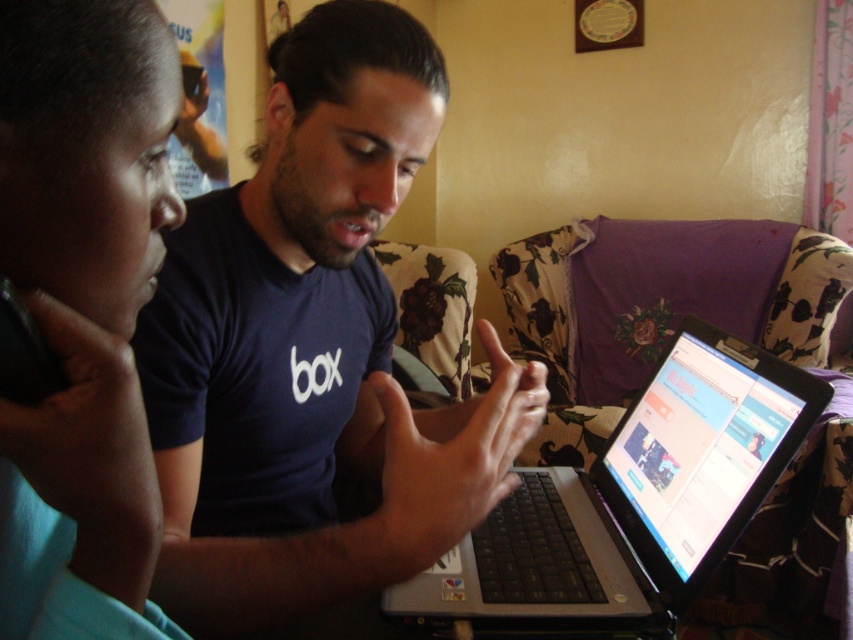
Question: Can you confirm if matte blue shirt at center is smaller than blue fabric at left?

Choices:
 (A) yes
 (B) no

Answer: (B)

Question: Among these points, which one is farthest from the camera?

Choices:
 (A) (482, 564)
 (B) (427, 456)

Answer: (A)

Question: Which of the following is the farthest from the observer?

Choices:
 (A) (619, 612)
 (B) (105, 440)

Answer: (A)

Question: Estimate the real-world distances between objects in this image. Which object is farther from the silver/black plastic laptop at center?

Choices:
 (A) matte blue shirt at center
 (B) blue fabric at left

Answer: (B)

Question: Is matte blue shirt at center smaller than silver/black plastic laptop at center?

Choices:
 (A) yes
 (B) no

Answer: (B)

Question: Is the position of blue fabric at left less distant than that of silver/black plastic laptop at center?

Choices:
 (A) no
 (B) yes

Answer: (B)